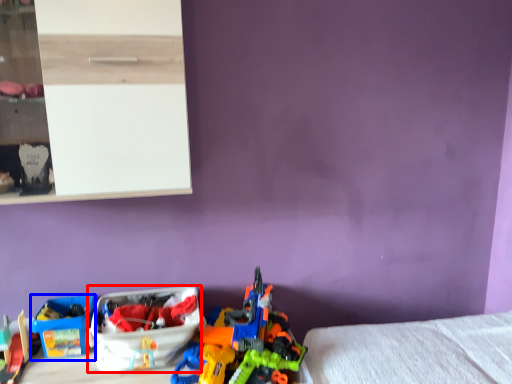
Question: Which object is closer to the camera taking this photo, storage box (highlighted by a red box) or storage box (highlighted by a blue box)?

Choices:
 (A) storage box
 (B) storage box

Answer: (A)